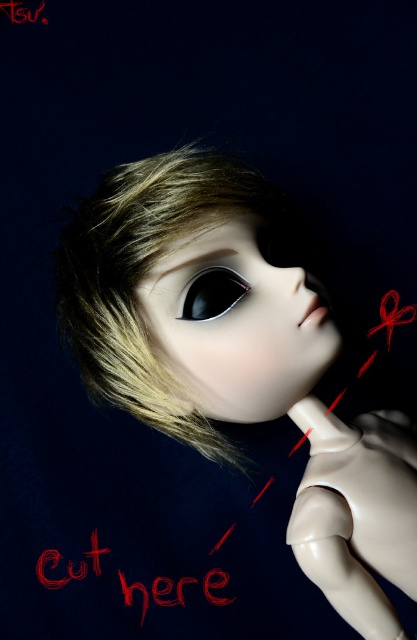
The height and width of the screenshot is (640, 417). In order to click on smooth porcelain face at center in this screenshot , I will do `click(238, 324)`.

Does smooth porcelain face at center have a lesser height compared to brushed metal text at center?

Result: No.

Where is `smooth porcelain face at center`? smooth porcelain face at center is located at coordinates (238, 324).

Between smooth porcelain face at center and black glossy eye at center, which one is positioned higher?

Positioned higher is black glossy eye at center.

Is smooth porcelain face at center bigger than black glossy eye at center?

Correct, smooth porcelain face at center is larger in size than black glossy eye at center.

What are the coordinates of `smooth porcelain face at center` in the screenshot? It's located at (238, 324).

The width and height of the screenshot is (417, 640). I want to click on smooth porcelain face at center, so click(x=238, y=324).

Can you confirm if matte plastic doll at center is positioned to the left of brushed metal text at center?

Incorrect, matte plastic doll at center is not on the left side of brushed metal text at center.

Which is behind, point (180, 296) or point (90, 556)?

The point (90, 556) is more distant.

Identify the location of matte plastic doll at center. (236, 356).

Locate an element on the screen. matte plastic doll at center is located at coordinates (236, 356).